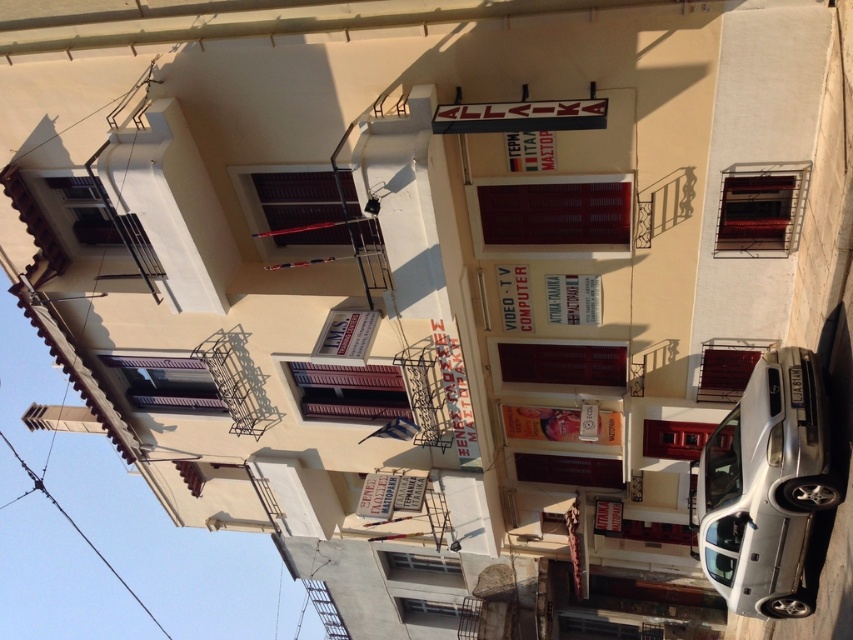
Question: Based on their relative distances, which object is nearer to the metallic red balcony at center?

Choices:
 (A) silver metallic car at lower right
 (B) metallic balcony at upper right

Answer: (A)

Question: Is silver metallic car at lower right below metallic balcony at upper right?

Choices:
 (A) no
 (B) yes

Answer: (B)

Question: Among these points, which one is farthest from the camera?

Choices:
 (A) (709, 392)
 (B) (785, 224)
 (C) (810, 429)

Answer: (A)

Question: Observing the image, what is the correct spatial positioning of silver metallic car at lower right in reference to metallic red balcony at center?

Choices:
 (A) below
 (B) above

Answer: (A)

Question: Can you confirm if silver metallic car at lower right is thinner than metallic red balcony at center?

Choices:
 (A) no
 (B) yes

Answer: (A)

Question: Which of these objects is positioned farthest from the metallic balcony at upper right?

Choices:
 (A) metallic red balcony at center
 (B) silver metallic car at lower right

Answer: (A)